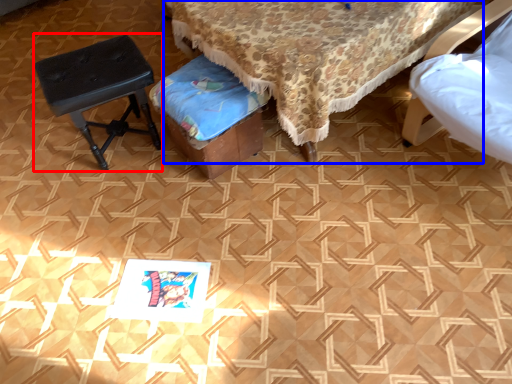
Question: Which of the following is the farthest to the observer, stool (highlighted by a red box) or furniture (highlighted by a blue box)?

Choices:
 (A) stool
 (B) furniture

Answer: (A)